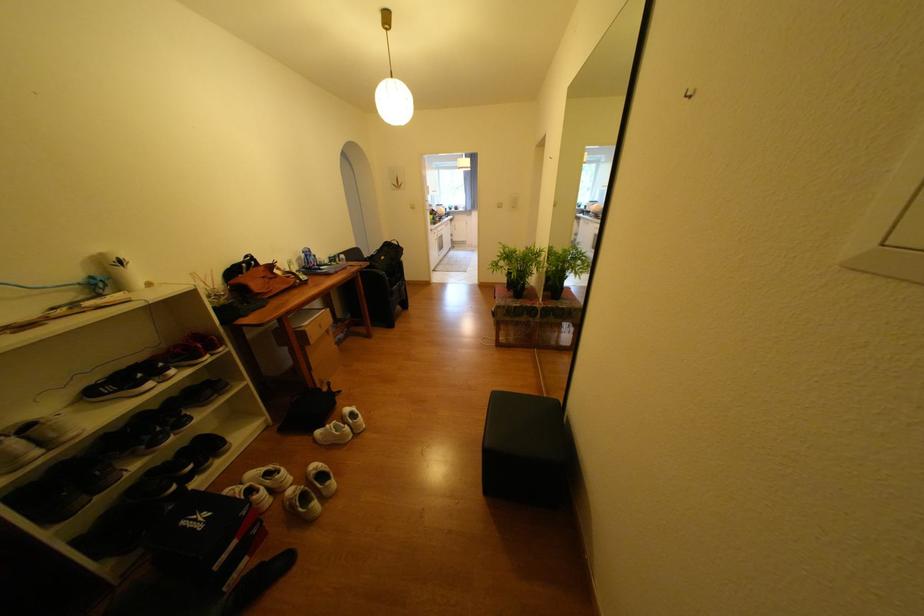
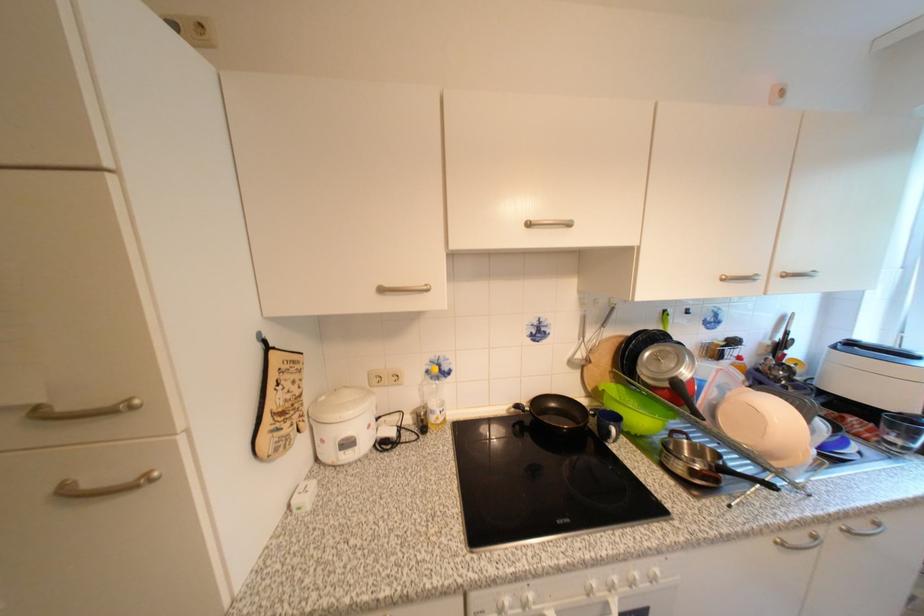
In the second image, find the point that corresponds to pixel 441 217 in the first image.

(651, 421)